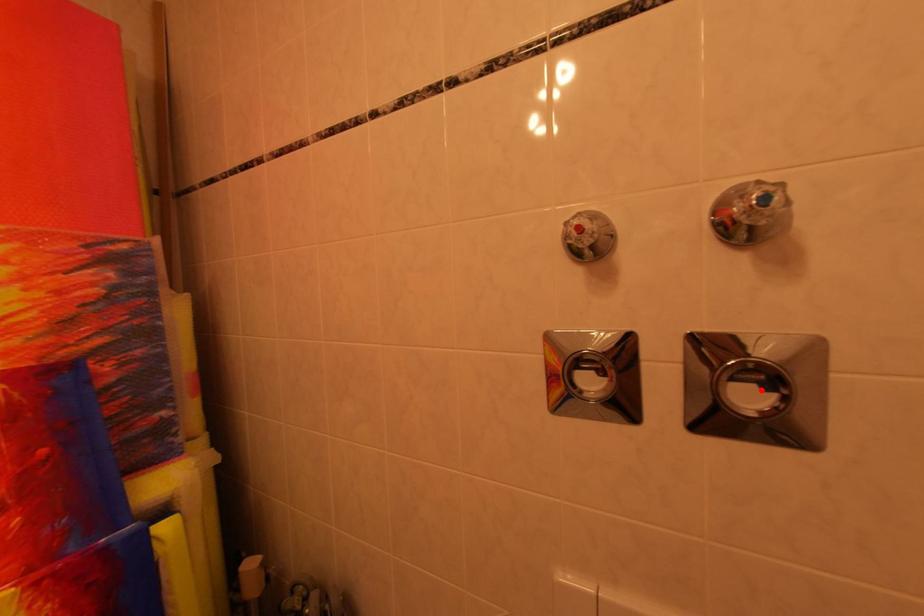
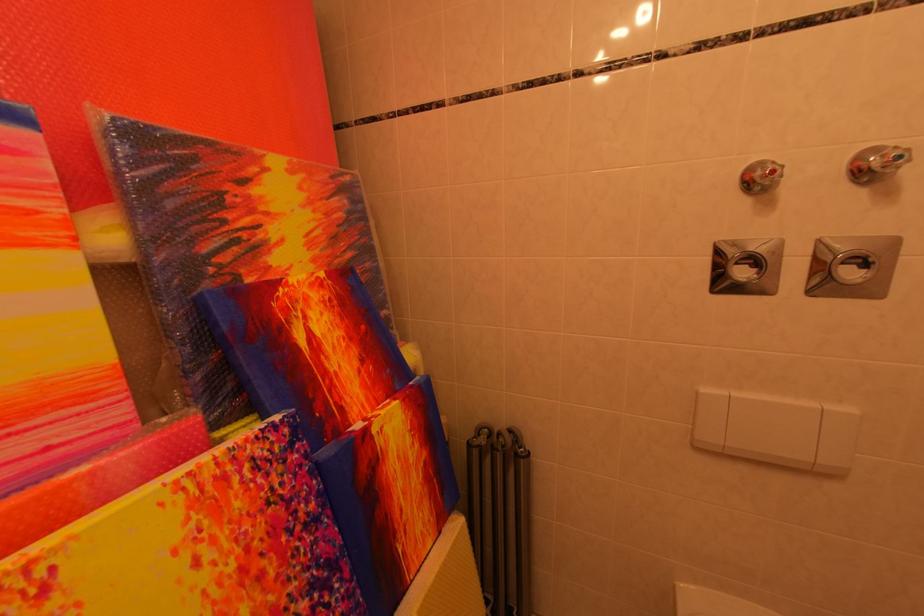
The point at the highlighted location is marked in the first image. Where is the corresponding point in the second image?

(864, 270)